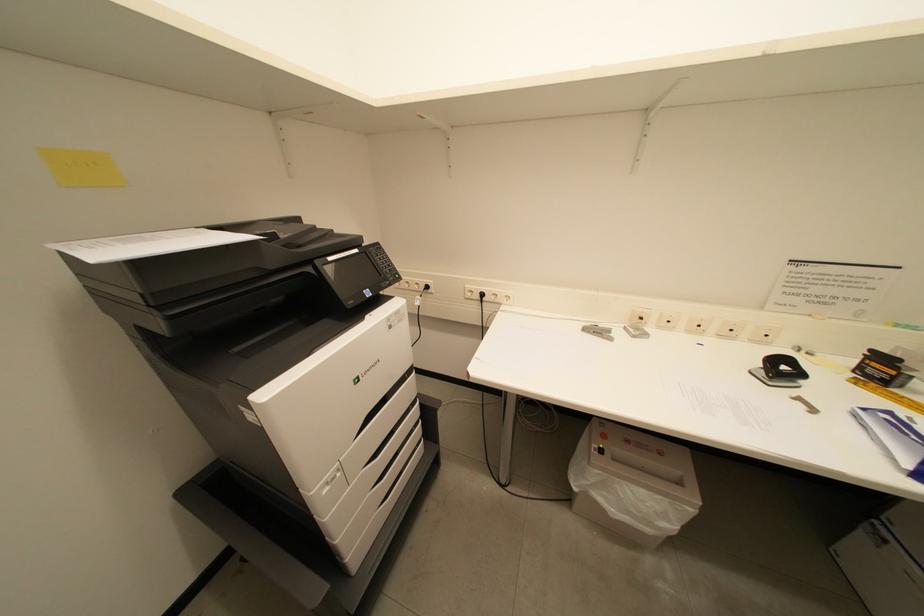
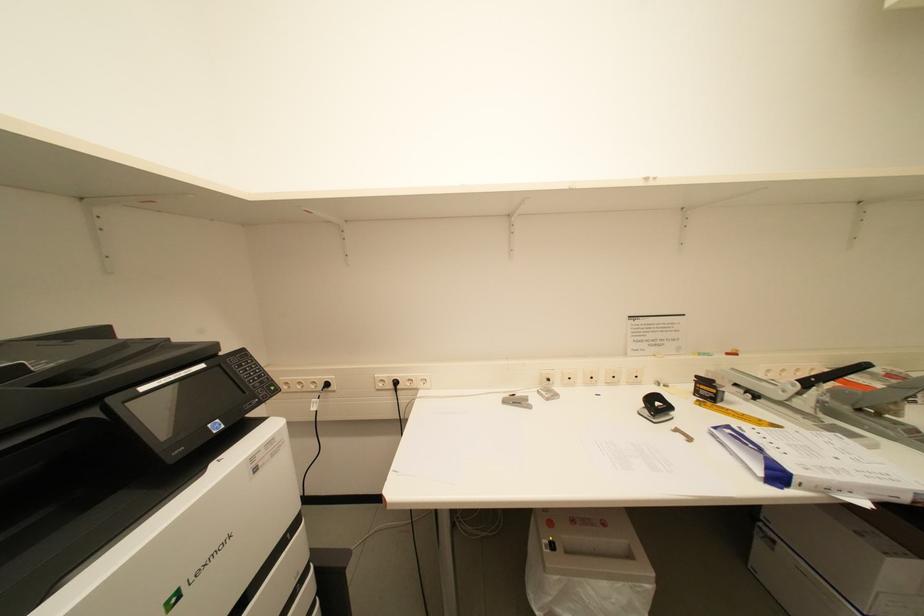
The first image is from the beginning of the video and the second image is from the end. How did the camera likely rotate when shooting the video?

The camera rotated toward right-up.